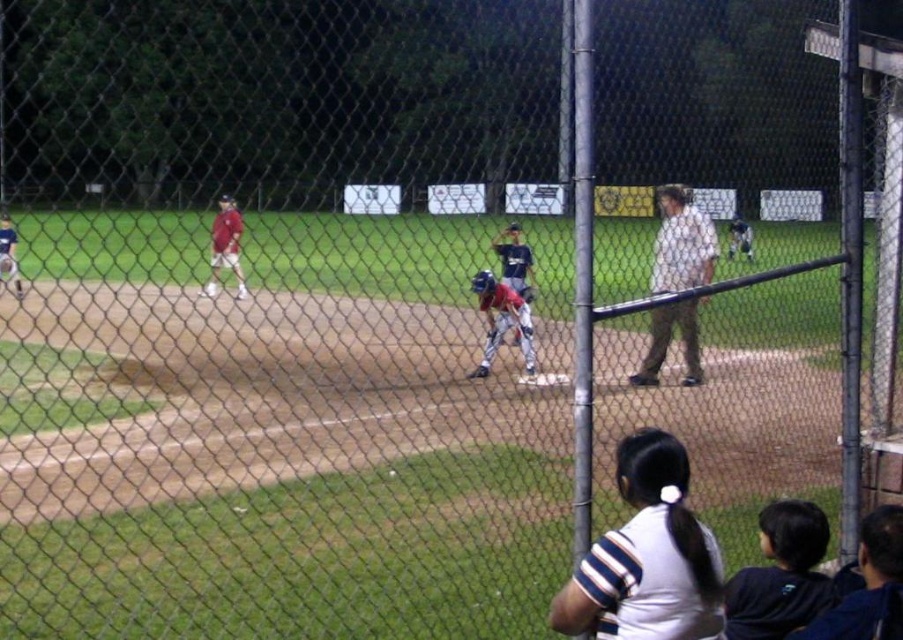
Question: Where is light brown cotton shirt at center located in relation to blue matte helmet at center in the image?

Choices:
 (A) right
 (B) left

Answer: (A)

Question: Can you confirm if blue matte helmet at center is bigger than matte red baseball uniform at left?

Choices:
 (A) no
 (B) yes

Answer: (A)

Question: Which object appears farthest from the camera in this image?

Choices:
 (A) blue matte helmet at center
 (B) matte red baseball uniform at left
 (C) dark blue shirt at lower right
 (D) light brown cotton shirt at center

Answer: (B)

Question: Which point is farther to the camera?

Choices:
 (A) dark blue shirt at lower right
 (B) blue matte helmet at center
 (C) light brown cotton shirt at center
 (D) matte red baseball uniform at left

Answer: (D)

Question: Considering the real-world distances, which object is closest to the dark blue shirt at lower right?

Choices:
 (A) light brown cotton shirt at center
 (B) matte red baseball uniform at left
 (C) blue matte helmet at center

Answer: (A)

Question: Is the position of dark blue shirt at lower right more distant than that of matte red baseball uniform at left?

Choices:
 (A) yes
 (B) no

Answer: (B)